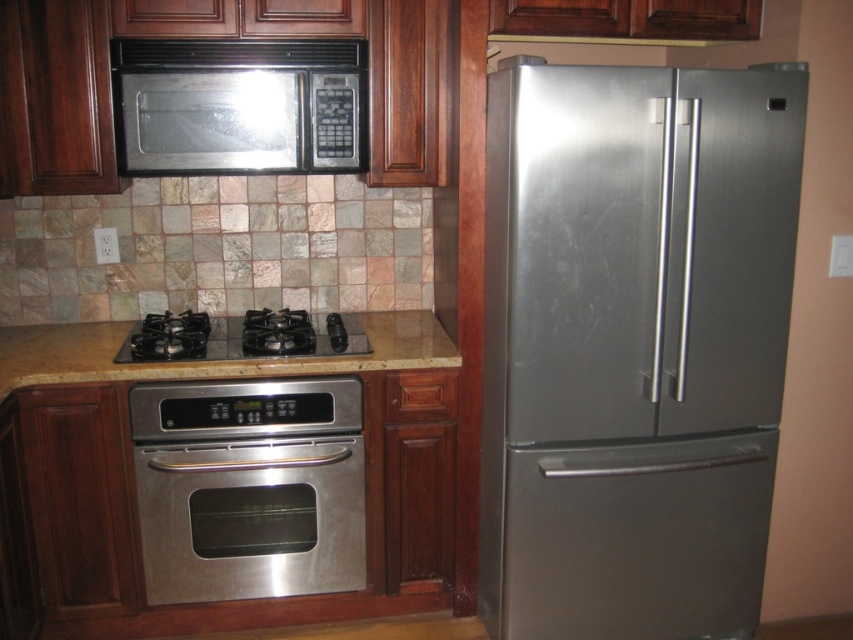
Can you confirm if stainless steel refrigerator at right is positioned to the left of black matte exhaust hood at upper center?

In fact, stainless steel refrigerator at right is to the right of black matte exhaust hood at upper center.

Locate an element on the screen. The width and height of the screenshot is (853, 640). stainless steel refrigerator at right is located at coordinates tap(633, 346).

You are a GUI agent. You are given a task and a screenshot of the screen. Output one action in this format:
    pyautogui.click(x=<x>, y=<y>)
    Task: Click on the stainless steel refrigerator at right
    The width and height of the screenshot is (853, 640).
    Given the screenshot: What is the action you would take?
    pyautogui.click(x=633, y=346)

The height and width of the screenshot is (640, 853). Find the location of `stainless steel refrigerator at right`. stainless steel refrigerator at right is located at coordinates (633, 346).

Which of these two, black matte exhaust hood at upper center or black glass stove at center, stands shorter?

With less height is black matte exhaust hood at upper center.

Image resolution: width=853 pixels, height=640 pixels. What are the coordinates of `black matte exhaust hood at upper center` in the screenshot? It's located at (235, 52).

Is stainless steel oven at center bigger than stainless steel microwave at upper center?

Yes.

What do you see at coordinates (248, 488) in the screenshot?
I see `stainless steel oven at center` at bounding box center [248, 488].

You are a GUI agent. You are given a task and a screenshot of the screen. Output one action in this format:
    pyautogui.click(x=<x>, y=<y>)
    Task: Click on the stainless steel oven at center
    
    Given the screenshot: What is the action you would take?
    pyautogui.click(x=248, y=488)